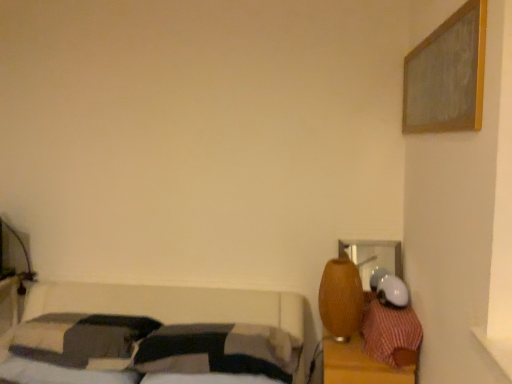
Question: Considering the relative sizes of braided wood table lamp at right and soft cotton pillow at center, marked as the 2th pillow in a left-to-right arrangement, in the image provided, is braided wood table lamp at right wider than soft cotton pillow at center, marked as the 2th pillow in a left-to-right arrangement,?

Choices:
 (A) yes
 (B) no

Answer: (B)

Question: Considering the relative sizes of braided wood table lamp at right and soft cotton pillow at center, marked as the 2th pillow in a left-to-right arrangement, in the image provided, is braided wood table lamp at right shorter than soft cotton pillow at center, marked as the 2th pillow in a left-to-right arrangement,?

Choices:
 (A) no
 (B) yes

Answer: (A)

Question: From a real-world perspective, is braided wood table lamp at right positioned under soft cotton pillow at center, positioned as the second pillow in right-to-left order, based on gravity?

Choices:
 (A) no
 (B) yes

Answer: (A)

Question: Is braided wood table lamp at right closer to camera compared to soft cotton pillow at center, marked as the 2th pillow in a left-to-right arrangement?

Choices:
 (A) no
 (B) yes

Answer: (A)

Question: Does braided wood table lamp at right appear on the left side of soft cotton pillow at center, marked as the 2th pillow in a left-to-right arrangement?

Choices:
 (A) no
 (B) yes

Answer: (A)

Question: In the image, is braided wood table lamp at right positioned in front of or behind soft cotton pillow at center, marked as the 2th pillow in a left-to-right arrangement?

Choices:
 (A) front
 (B) behind

Answer: (B)

Question: Based on their sizes in the image, would you say braided wood table lamp at right is bigger or smaller than soft cotton pillow at center, marked as the 2th pillow in a left-to-right arrangement?

Choices:
 (A) big
 (B) small

Answer: (B)

Question: From the image's perspective, is braided wood table lamp at right located above or below soft cotton pillow at center, positioned as the second pillow in right-to-left order?

Choices:
 (A) below
 (B) above

Answer: (B)

Question: Considering the relative positions of braided wood table lamp at right and soft cotton pillow at center, marked as the 2th pillow in a left-to-right arrangement, in the image provided, is braided wood table lamp at right to the left or to the right of soft cotton pillow at center, marked as the 2th pillow in a left-to-right arrangement,?

Choices:
 (A) left
 (B) right

Answer: (B)

Question: From the image's perspective, is red plaid pillow at right, marked as the 3th pillow in a left-to-right arrangement, located above or below braided wood table lamp at right?

Choices:
 (A) above
 (B) below

Answer: (B)

Question: From a real-world perspective, is red plaid pillow at right, which is the first pillow from right to left, physically located above or below braided wood table lamp at right?

Choices:
 (A) above
 (B) below

Answer: (B)

Question: In terms of width, does red plaid pillow at right, which is the first pillow from right to left, look wider or thinner when compared to braided wood table lamp at right?

Choices:
 (A) wide
 (B) thin

Answer: (A)

Question: Does point (376, 334) appear closer or farther from the camera than point (350, 316)?

Choices:
 (A) closer
 (B) farther

Answer: (A)

Question: Considering the relative positions of soft cotton pillow at center, positioned as the second pillow in right-to-left order, and dark gray fabric pillow at lower left, the 1th pillow positioned from the left, in the image provided, is soft cotton pillow at center, positioned as the second pillow in right-to-left order, to the left or to the right of dark gray fabric pillow at lower left, the 1th pillow positioned from the left,?

Choices:
 (A) right
 (B) left

Answer: (A)

Question: From a real-world perspective, is soft cotton pillow at center, marked as the 2th pillow in a left-to-right arrangement, above or below dark gray fabric pillow at lower left, placed as the third pillow when sorted from right to left?

Choices:
 (A) below
 (B) above

Answer: (A)